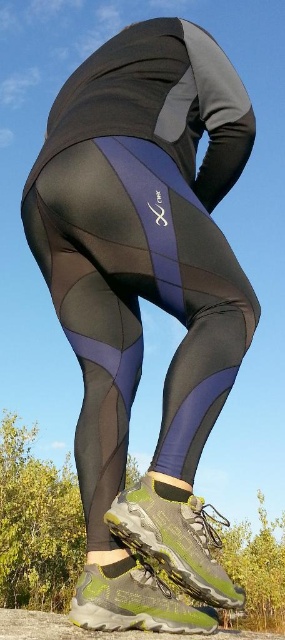
You are trying to decide which shoe to wear for a short hike. You have two options in front of you, the green mesh shoe at lower center and the green textured hiking boot at lower center. Based on their sizes, which one might be more suitable for rough terrain?

The green textured hiking boot at lower center is more suitable for rough terrain because it is smaller than the green mesh shoe at lower center, which typically provides better support and stability for hiking.

You are a photographer setting up a shoot focusing on the lower body. You need to ensure that the green mesh shoe at lower center and the green textured hiking boot at lower center are both visible in the frame. Which one should you position closer to the center of the image to achieve this?

The green mesh shoe at lower center is positioned on the right side of the green textured hiking boot at lower center. To ensure both are visible, position the green textured hiking boot at lower center closer to the center so the green mesh shoe at lower center on its right remains in frame.

You are a photographer trying to capture the brand name on the right leg of the leggings. However, the green mesh shoe at lower center and green textured hiking boot at lower center are blocking your view. Which object should you move to get a clear shot of the brand name?

You should move the green mesh shoe at lower center because it is positioned over the green textured hiking boot at lower center, so moving it would reveal the boot and potentially allow a clearer view of the brand name on the right leg.